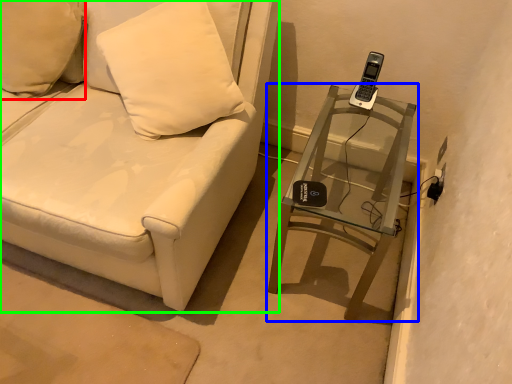
Question: Estimate the real-world distances between objects in this image. Which object is farther from pillow (highlighted by a red box), table (highlighted by a blue box) or furniture (highlighted by a green box)?

Choices:
 (A) table
 (B) furniture

Answer: (A)